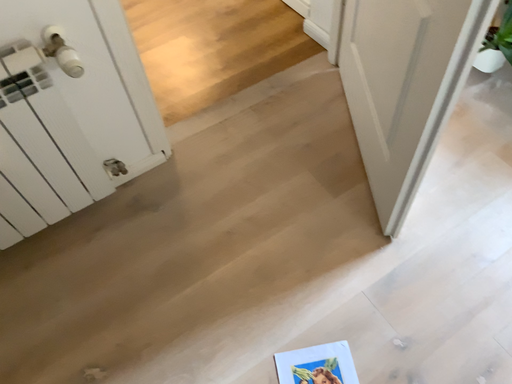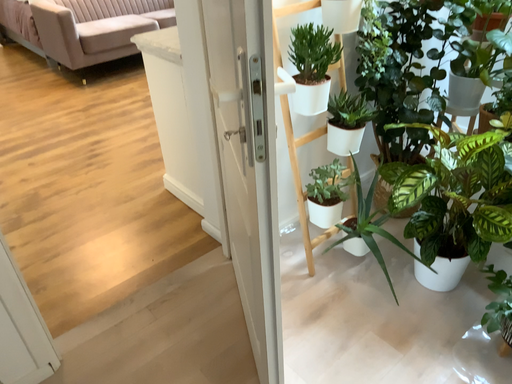
Question: Which way did the camera rotate in the video?

Choices:
 (A) rotated downward
 (B) rotated upward

Answer: (B)